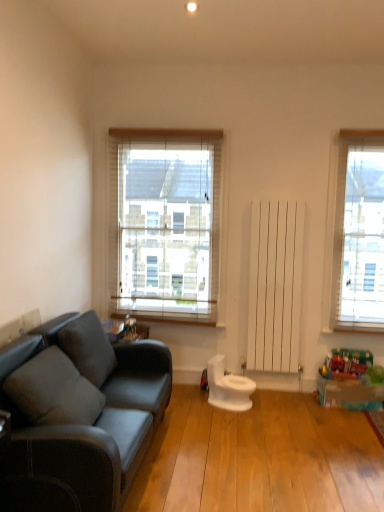
Question: From the image's perspective, is metallic silver toy at center, the 2th toy positioned from the bottom, on white wood blinds at center?

Choices:
 (A) no
 (B) yes

Answer: (A)

Question: Is metallic silver toy at center, which is the second toy from right to left, touching white wood blinds at center?

Choices:
 (A) yes
 (B) no

Answer: (B)

Question: Considering the relative positions of metallic silver toy at center, which is the second toy from right to left, and white wood blinds at center in the image provided, is metallic silver toy at center, which is the second toy from right to left, behind white wood blinds at center?

Choices:
 (A) yes
 (B) no

Answer: (B)

Question: From the image's perspective, is metallic silver toy at center, which is the first toy in top-to-bottom order, under white wood blinds at center?

Choices:
 (A) yes
 (B) no

Answer: (A)

Question: From a real-world perspective, does metallic silver toy at center, which is the second toy from right to left, stand above white wood blinds at center?

Choices:
 (A) no
 (B) yes

Answer: (A)

Question: From a real-world perspective, is gray fabric pillow at left, marked as the second pillow in a front-to-back arrangement, positioned above or below metallic silver toy at center, which is the second toy from right to left?

Choices:
 (A) below
 (B) above

Answer: (A)

Question: Is point (89, 325) positioned closer to the camera than point (125, 338)?

Choices:
 (A) farther
 (B) closer

Answer: (B)

Question: Visually, is gray fabric pillow at left, the first pillow when ordered from back to front, positioned to the left or to the right of metallic silver toy at center, the 2th toy positioned from the bottom?

Choices:
 (A) right
 (B) left

Answer: (B)

Question: Is gray fabric pillow at left, the first pillow when ordered from back to front, spatially inside metallic silver toy at center, which is the first toy in top-to-bottom order, or outside of it?

Choices:
 (A) inside
 (B) outside

Answer: (B)

Question: In terms of width, does metallic silver toy at center, which is the second toy from right to left, look wider or thinner when compared to gray fabric pillow at left, marked as the second pillow in a front-to-back arrangement?

Choices:
 (A) wide
 (B) thin

Answer: (B)

Question: From the image's perspective, is metallic silver toy at center, the first toy in the left-to-right sequence, positioned above or below gray fabric pillow at left, marked as the second pillow in a front-to-back arrangement?

Choices:
 (A) above
 (B) below

Answer: (A)

Question: Is metallic silver toy at center, the 2th toy positioned from the bottom, taller or shorter than gray fabric pillow at left, the first pillow when ordered from back to front?

Choices:
 (A) tall
 (B) short

Answer: (B)

Question: Based on their sizes in the image, would you say metallic silver toy at center, the 2th toy positioned from the bottom, is bigger or smaller than gray fabric pillow at left, the first pillow when ordered from back to front?

Choices:
 (A) big
 (B) small

Answer: (B)

Question: Considering the relative positions of translucent plastic toy at lower right, the 2th toy viewed from the top, and soft gray cushion at left, which ranks as the 2th pillow in back-to-front order, in the image provided, is translucent plastic toy at lower right, the 2th toy viewed from the top, to the left or to the right of soft gray cushion at left, which ranks as the 2th pillow in back-to-front order,?

Choices:
 (A) right
 (B) left

Answer: (A)

Question: From the image's perspective, is translucent plastic toy at lower right, the second toy positioned from the left, above or below soft gray cushion at left, acting as the 1th pillow starting from the front?

Choices:
 (A) below
 (B) above

Answer: (A)